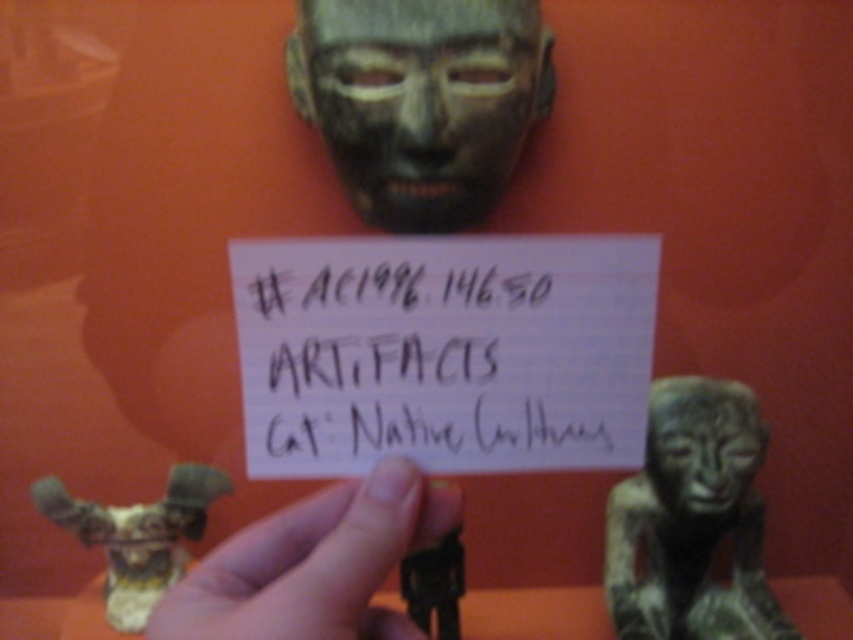
Question: Does bronze mask at center appear under matte black hand at center?

Choices:
 (A) yes
 (B) no

Answer: (B)

Question: Is bronze mask at center closer to camera compared to gold metallic figurine at center?

Choices:
 (A) yes
 (B) no

Answer: (A)

Question: Can you confirm if black paper at center is positioned to the right of gold metallic figurine at center?

Choices:
 (A) no
 (B) yes

Answer: (B)

Question: Which point is farther to the camera?

Choices:
 (A) (80, 525)
 (B) (354, 74)
 (C) (686, 616)

Answer: (C)

Question: Which of the following is the farthest from the observer?

Choices:
 (A) (450, 200)
 (B) (294, 557)
 (C) (722, 484)
 (D) (178, 557)

Answer: (D)

Question: Which object is closer to the camera taking this photo?

Choices:
 (A) gold metallic figurine at center
 (B) bronze mask at center
 (C) black paper at center
 (D) matte bronze figure at center

Answer: (C)